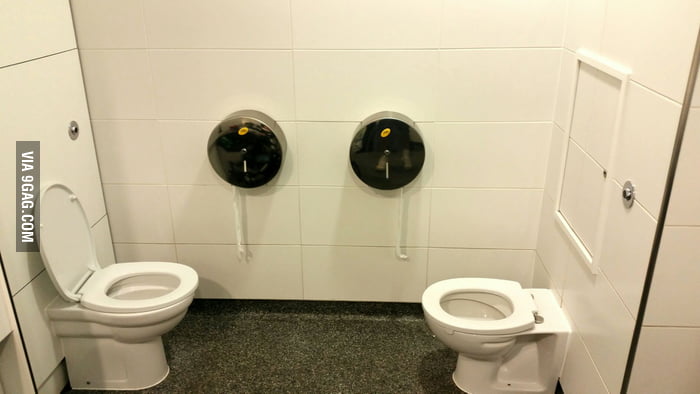
Find the location of `toilet seat`. toilet seat is located at coordinates (181, 289), (427, 302).